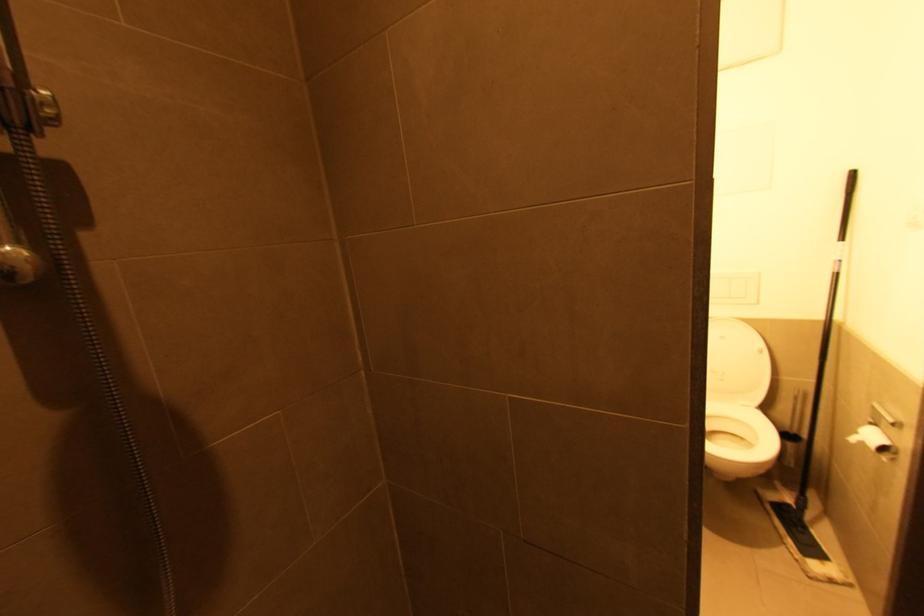
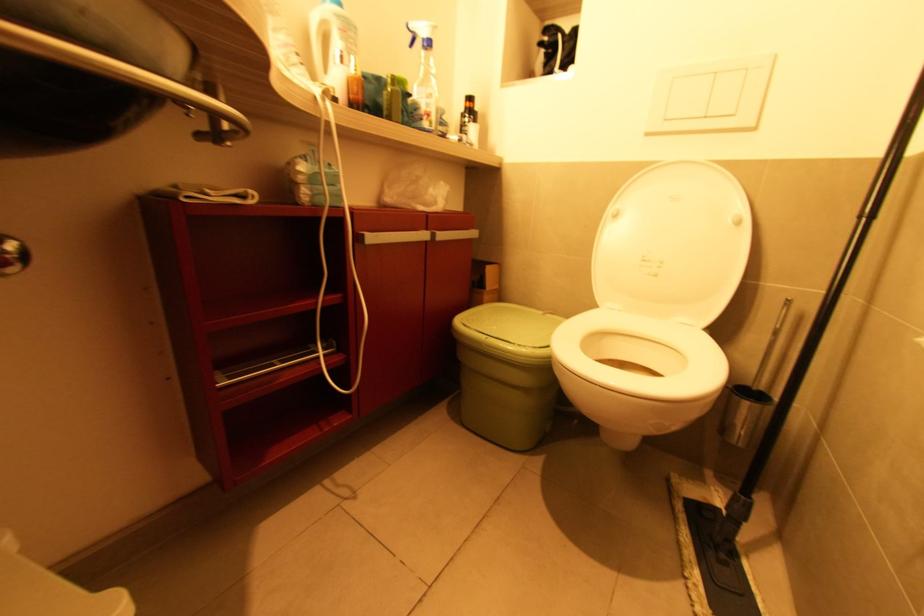
Find the pixel in the second image that matches point 793,406 in the first image.

(771, 338)